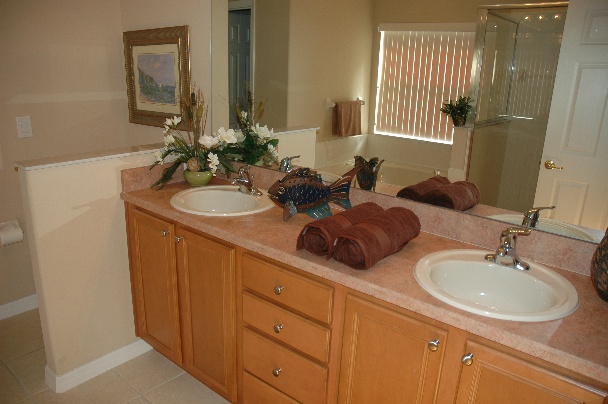
Locate an element on the screen. The width and height of the screenshot is (608, 404). toilet paper is located at coordinates (14, 229).